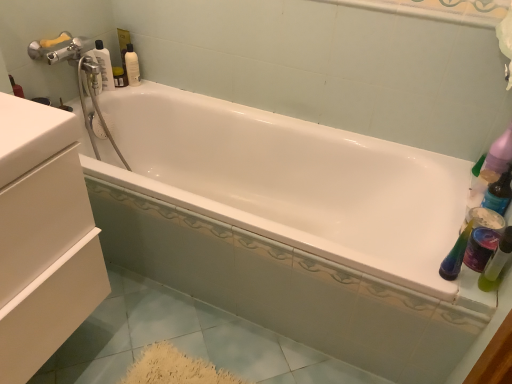
Question: Is green translucent bottle at right, the 1th mouthwash viewed from the front, wider than transparent plastic bottle at upper left?

Choices:
 (A) no
 (B) yes

Answer: (A)

Question: Is green translucent bottle at right, the 1th mouthwash viewed from the front, not within transparent plastic bottle at upper left?

Choices:
 (A) no
 (B) yes

Answer: (B)

Question: From a real-world perspective, is green translucent bottle at right, the first mouthwash when ordered from right to left, positioned over transparent plastic bottle at upper left based on gravity?

Choices:
 (A) no
 (B) yes

Answer: (A)

Question: Considering the relative positions of green translucent bottle at right, arranged as the first mouthwash when ordered from the bottom, and transparent plastic bottle at upper left in the image provided, is green translucent bottle at right, arranged as the first mouthwash when ordered from the bottom, in front of transparent plastic bottle at upper left?

Choices:
 (A) yes
 (B) no

Answer: (A)

Question: Could transparent plastic bottle at upper left be considered to be inside green translucent bottle at right, arranged as the second mouthwash when viewed from the back?

Choices:
 (A) no
 (B) yes

Answer: (A)

Question: Considering the positions of green translucent bottle at right, arranged as the second mouthwash when viewed from the back, and transparent plastic bottle at upper left in the image, is green translucent bottle at right, arranged as the second mouthwash when viewed from the back, wider or thinner than transparent plastic bottle at upper left?

Choices:
 (A) thin
 (B) wide

Answer: (A)

Question: Is green translucent bottle at right, the 2th mouthwash positioned from the left, spatially inside transparent plastic bottle at upper left, or outside of it?

Choices:
 (A) inside
 (B) outside

Answer: (B)

Question: In terms of height, does green translucent bottle at right, the 2th mouthwash positioned from the left, look taller or shorter compared to transparent plastic bottle at upper left?

Choices:
 (A) tall
 (B) short

Answer: (B)

Question: Does point (499, 274) appear closer or farther from the camera than point (109, 84)?

Choices:
 (A) farther
 (B) closer

Answer: (B)

Question: In the image, is white glossy mouthwash at upper left, acting as the second mouthwash starting from the front, on the left side or the right side of transparent plastic bottle at upper left?

Choices:
 (A) right
 (B) left

Answer: (A)

Question: From a real-world perspective, relative to transparent plastic bottle at upper left, is white glossy mouthwash at upper left, arranged as the second mouthwash when ordered from the bottom, vertically above or below?

Choices:
 (A) below
 (B) above

Answer: (A)

Question: From their relative heights in the image, would you say white glossy mouthwash at upper left, acting as the second mouthwash starting from the front, is taller or shorter than transparent plastic bottle at upper left?

Choices:
 (A) short
 (B) tall

Answer: (A)

Question: Considering the positions of point (128, 51) and point (111, 81), is point (128, 51) closer or farther from the camera than point (111, 81)?

Choices:
 (A) closer
 (B) farther

Answer: (B)

Question: Looking at their shapes, would you say green translucent bottle at right, arranged as the first mouthwash when ordered from the bottom, is wider or thinner than white matte drawer at left?

Choices:
 (A) wide
 (B) thin

Answer: (B)

Question: In terms of height, does green translucent bottle at right, the 2th mouthwash positioned from the left, look taller or shorter compared to white matte drawer at left?

Choices:
 (A) short
 (B) tall

Answer: (A)